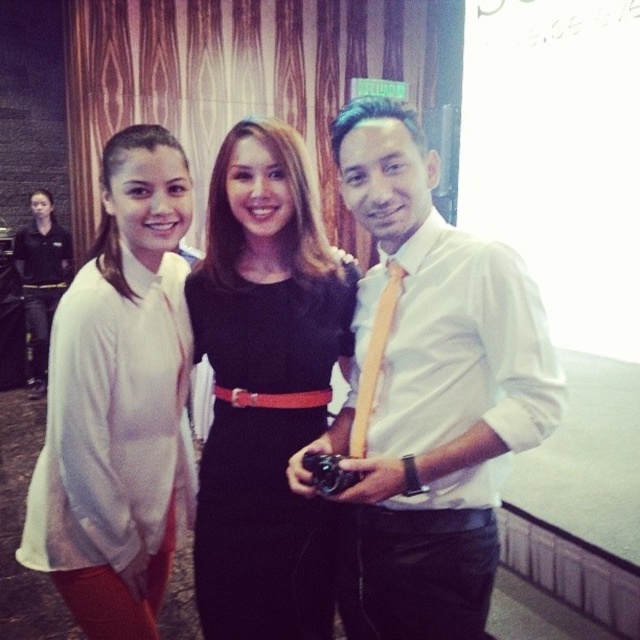
Question: Which of these objects is positioned closest to the black uniform at left?

Choices:
 (A) yellow satin tie at center
 (B) matte white blouse at left
 (C) black satin dress at center

Answer: (C)

Question: Is matte white blouse at left in front of black uniform at left?

Choices:
 (A) yes
 (B) no

Answer: (A)

Question: Which of the following is the farthest from the observer?

Choices:
 (A) (403, 273)
 (B) (68, 273)
 (C) (266, 349)

Answer: (B)

Question: Which point is closer to the camera?

Choices:
 (A) (60, 237)
 (B) (204, 500)
 (C) (388, 289)

Answer: (C)

Question: Is black satin dress at center smaller than yellow satin tie at center?

Choices:
 (A) yes
 (B) no

Answer: (B)

Question: Is black uniform at left in front of yellow satin tie at center?

Choices:
 (A) yes
 (B) no

Answer: (B)